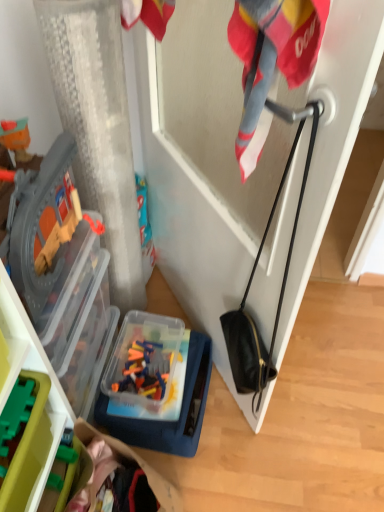
Question: Is point (208, 340) closer or farther from the camera than point (11, 403)?

Choices:
 (A) farther
 (B) closer

Answer: (A)

Question: From the image's perspective, is translucent plastic container at lower center above or below green plastic toy blocks at lower left?

Choices:
 (A) above
 (B) below

Answer: (B)

Question: From a real-world perspective, is translucent plastic container at lower center positioned above or below green plastic toy blocks at lower left?

Choices:
 (A) above
 (B) below

Answer: (B)

Question: Relative to translucent plastic container at lower center, is green plastic toy blocks at lower left in front or behind?

Choices:
 (A) behind
 (B) front

Answer: (B)

Question: From the image's perspective, relative to translucent plastic container at lower center, is green plastic toy blocks at lower left above or below?

Choices:
 (A) above
 (B) below

Answer: (A)

Question: From a real-world perspective, relative to translucent plastic container at lower center, is green plastic toy blocks at lower left vertically above or below?

Choices:
 (A) above
 (B) below

Answer: (A)

Question: Is green plastic toy blocks at lower left wider or thinner than translucent plastic container at lower center?

Choices:
 (A) thin
 (B) wide

Answer: (A)